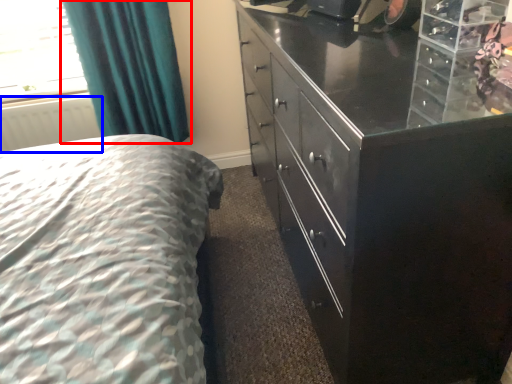
Question: Which of the following is the farthest to the observer, curtain (highlighted by a red box) or radiator (highlighted by a blue box)?

Choices:
 (A) curtain
 (B) radiator

Answer: (B)